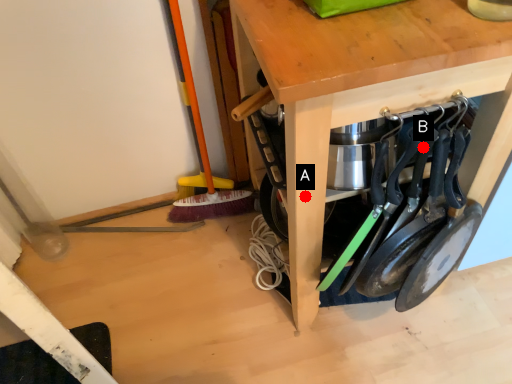
Question: Two points are circled on the image, labeled by A and B beside each circle. Which point is further to the camera?

Choices:
 (A) A is further
 (B) B is further

Answer: (A)